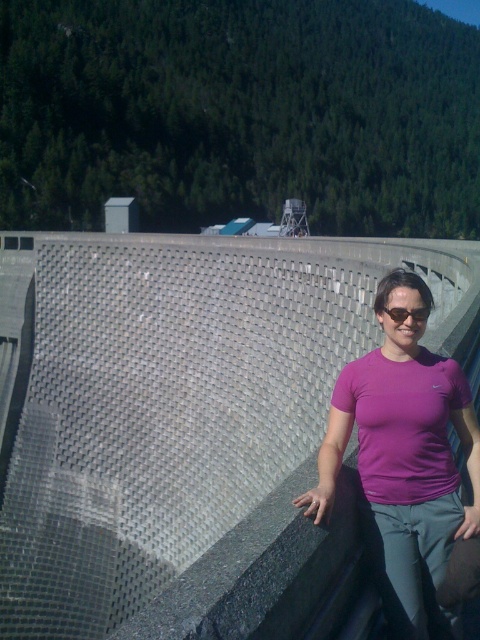
You are a drone operator trying to capture the gray textured dam at center from above. What coordinates should you aim for to ensure the drone is directly above the dam?

The gray textured dam at center is located at coordinates point (x=186, y=422), so the drone should aim for those coordinates to be directly above it.